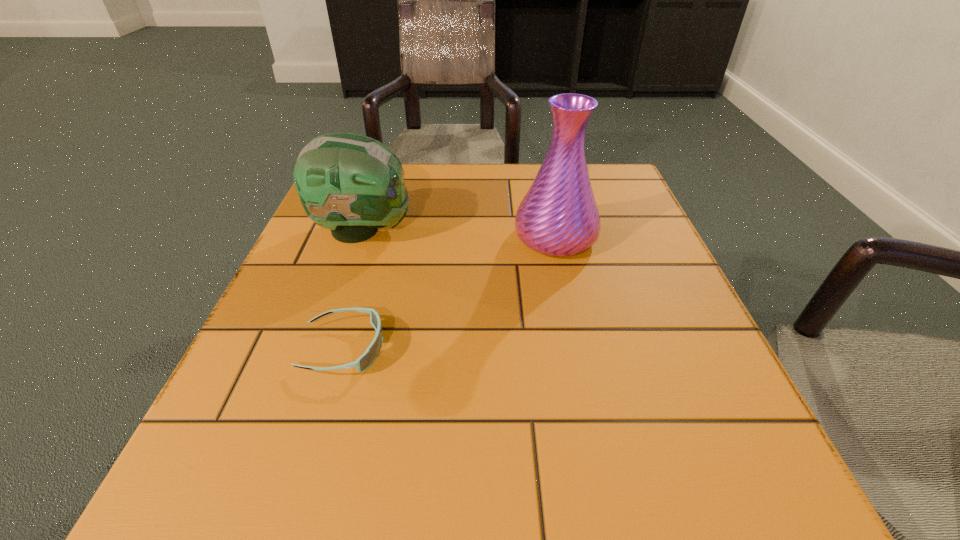
You are a GUI agent. You are given a task and a screenshot of the screen. Output one action in this format:
    pyautogui.click(x=<x>, y=<y>)
    Task: Click on the tallest object
    
    Given the screenshot: What is the action you would take?
    pyautogui.click(x=559, y=216)

The height and width of the screenshot is (540, 960). Find the location of `the rightmost object`. the rightmost object is located at coordinates (559, 216).

This screenshot has width=960, height=540. Identify the location of football helmet. click(x=352, y=184).

Find the location of a particular element. goggles is located at coordinates (370, 355).

The image size is (960, 540). Find the location of `the nearest object`. the nearest object is located at coordinates (370, 355).

At what (x,y) coordinates should I click in order to perform the action: click on vacant space located on the front of the rightmost object. Please return your answer as a coordinate pair (x, y). This screenshot has height=540, width=960. Looking at the image, I should click on (578, 341).

The width and height of the screenshot is (960, 540). I want to click on blank space located 0.190m on the visor of the second tallest object, so click(505, 230).

Find the location of a particular element. The image size is (960, 540). vacant region located on the front-facing side of the shortest object is located at coordinates (602, 348).

I want to click on vase located at the far edge, so click(x=559, y=216).

The image size is (960, 540). I want to click on football helmet located at the far edge, so click(x=352, y=184).